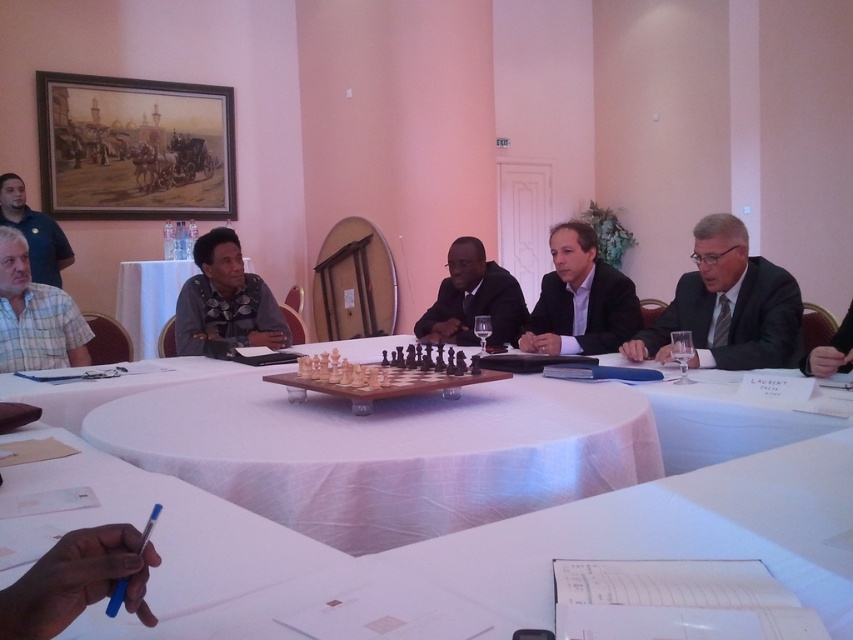
Question: Can you confirm if denim jacket at center is thinner than white plastic table at center?

Choices:
 (A) yes
 (B) no

Answer: (A)

Question: Is denim jacket at center positioned at the back of white plastic table at center?

Choices:
 (A) no
 (B) yes

Answer: (A)

Question: Which object is positioned closest to the matte black suit at center?

Choices:
 (A) black suit at center
 (B) plaid cotton shirt at lower left

Answer: (A)

Question: Which point is closer to the camera?

Choices:
 (A) white cloth-covered table at center
 (B) matte black suit at center
 (C) wooden chess set at center
 (D) black suit at center

Answer: (A)

Question: Can you confirm if plaid cotton shirt at lower left is thinner than white plastic table at center?

Choices:
 (A) yes
 (B) no

Answer: (A)

Question: Which object is farther from the camera taking this photo?

Choices:
 (A) plaid cotton shirt at lower left
 (B) matte blue shirt at upper left
 (C) white cloth-covered table at center
 (D) dark gray suit at center

Answer: (B)